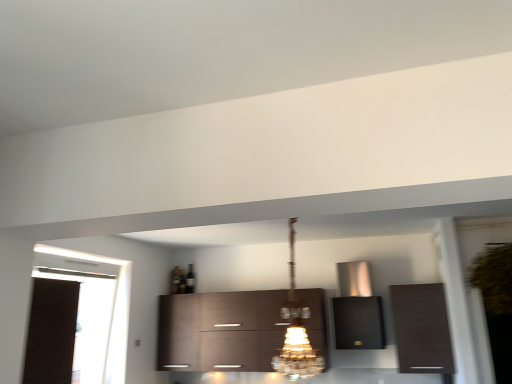
What do you see at coordinates (94, 309) in the screenshot? Image resolution: width=512 pixels, height=384 pixels. I see `black fabric curtain at left` at bounding box center [94, 309].

This screenshot has height=384, width=512. What do you see at coordinates (221, 331) in the screenshot?
I see `dark wood cabinet at center, acting as the 3th cabinetry starting from the right` at bounding box center [221, 331].

In order to click on satin metallic range hood at center, placed as the second cabinetry when sorted from right to left in this screenshot , I will do `click(358, 322)`.

At what (x,y) coordinates should I click in order to perform the action: click on crystal glass chandelier at center. Please return your answer as a coordinate pair (x, y). Looking at the image, I should click on pyautogui.click(x=296, y=331).

Is dark wood cabinet at right, which is the third cabinetry in left-to-right order, wider or thinner than satin metallic range hood at center, the 2th cabinetry viewed from the left?

In the image, dark wood cabinet at right, which is the third cabinetry in left-to-right order, appears to be more narrow than satin metallic range hood at center, the 2th cabinetry viewed from the left.

Would you say dark wood cabinet at right, which is the third cabinetry in left-to-right order, is a long distance from satin metallic range hood at center, placed as the second cabinetry when sorted from right to left?

dark wood cabinet at right, which is the third cabinetry in left-to-right order, is actually quite close to satin metallic range hood at center, placed as the second cabinetry when sorted from right to left.

Is dark wood cabinet at right, the first cabinetry viewed from the right, spatially inside satin metallic range hood at center, placed as the second cabinetry when sorted from right to left, or outside of it?

dark wood cabinet at right, the first cabinetry viewed from the right, cannot be found inside satin metallic range hood at center, placed as the second cabinetry when sorted from right to left.

Does dark wood cabinet at right, the first cabinetry viewed from the right, have a greater height compared to satin metallic range hood at center, the 2th cabinetry viewed from the left?

No.

Are black fabric curtain at left and crystal glass chandelier at center beside each other?

No, black fabric curtain at left is not making contact with crystal glass chandelier at center.

Considering the relative positions of black fabric curtain at left and crystal glass chandelier at center in the image provided, is black fabric curtain at left to the left of crystal glass chandelier at center from the viewer's perspective?

Indeed, black fabric curtain at left is positioned on the left side of crystal glass chandelier at center.

From a real-world perspective, who is located lower, black fabric curtain at left or crystal glass chandelier at center?

In real-world perspective, black fabric curtain at left is lower.

Is satin metallic range hood at center, placed as the second cabinetry when sorted from right to left, in contact with dark wood cabinet at right, the first cabinetry viewed from the right?

satin metallic range hood at center, placed as the second cabinetry when sorted from right to left, and dark wood cabinet at right, the first cabinetry viewed from the right, are clearly separated.

From a real-world perspective, which object rests below the other?

From a 3D spatial view, dark wood cabinet at right, the first cabinetry viewed from the right, is below.

Between point (350, 334) and point (438, 355), which one is positioned in front?

The point (438, 355) is in front.

Considering the points (46, 271) and (403, 356), which point is behind, point (46, 271) or point (403, 356)?

Point (403, 356)

Is black fabric curtain at left oriented towards dark wood cabinet at right, which is the third cabinetry in left-to-right order?

Yes, black fabric curtain at left is oriented towards dark wood cabinet at right, which is the third cabinetry in left-to-right order.

Based on their positions, is black fabric curtain at left located to the left or right of dark wood cabinet at right, which is the third cabinetry in left-to-right order?

black fabric curtain at left is to the left of dark wood cabinet at right, which is the third cabinetry in left-to-right order.

Between satin metallic range hood at center, the 2th cabinetry viewed from the left, and crystal glass chandelier at center, which one has larger width?

With larger width is crystal glass chandelier at center.

Does satin metallic range hood at center, placed as the second cabinetry when sorted from right to left, have a larger size compared to crystal glass chandelier at center?

No.

Measure the distance from satin metallic range hood at center, placed as the second cabinetry when sorted from right to left, to crystal glass chandelier at center.

4.39 feet.

Is satin metallic range hood at center, the 2th cabinetry viewed from the left, touching crystal glass chandelier at center?

No, satin metallic range hood at center, the 2th cabinetry viewed from the left, is not in contact with crystal glass chandelier at center.

From the picture: Considering the relative positions of crystal glass chandelier at center and dark wood cabinet at center, acting as the 3th cabinetry starting from the right, in the image provided, is crystal glass chandelier at center to the right of dark wood cabinet at center, acting as the 3th cabinetry starting from the right, from the viewer's perspective?

Yes, crystal glass chandelier at center is to the right of dark wood cabinet at center, acting as the 3th cabinetry starting from the right.

From a real-world perspective, between crystal glass chandelier at center and dark wood cabinet at center, acting as the 3th cabinetry starting from the right, who is vertically higher?

crystal glass chandelier at center is physically above.

Considering the positions of point (303, 312) and point (267, 291), is point (303, 312) closer or farther from the camera than point (267, 291)?

Clearly, point (303, 312) is closer to the camera than point (267, 291).

From the image's perspective, which one is positioned higher, crystal glass chandelier at center or dark wood cabinet at center, acting as the 3th cabinetry starting from the right?

crystal glass chandelier at center appears higher in the image.

Which is correct: dark wood cabinet at center, acting as the 3th cabinetry starting from the right, is inside crystal glass chandelier at center, or outside of it?

dark wood cabinet at center, acting as the 3th cabinetry starting from the right, exists outside the volume of crystal glass chandelier at center.

Is dark wood cabinet at center, the first cabinetry viewed from the left, bigger than crystal glass chandelier at center?

Yes.

In terms of height, does dark wood cabinet at center, acting as the 3th cabinetry starting from the right, look taller or shorter compared to crystal glass chandelier at center?

Clearly, dark wood cabinet at center, acting as the 3th cabinetry starting from the right, is shorter compared to crystal glass chandelier at center.

Are dark wood cabinet at center, acting as the 3th cabinetry starting from the right, and crystal glass chandelier at center far apart?

Yes, dark wood cabinet at center, acting as the 3th cabinetry starting from the right, and crystal glass chandelier at center are quite far apart.

Where is `the 1st cabinetry to the left of the dark wood cabinet at right, which is the third cabinetry in left-to-right order, starting your count from the anchor`? This screenshot has height=384, width=512. the 1st cabinetry to the left of the dark wood cabinet at right, which is the third cabinetry in left-to-right order, starting your count from the anchor is located at coordinates (358, 322).

The image size is (512, 384). I want to click on light fixture that is above the black fabric curtain at left (from a real-world perspective), so click(296, 331).

When comparing their distances from black fabric curtain at left, does crystal glass chandelier at center or dark wood cabinet at center, acting as the 3th cabinetry starting from the right, seem further?

Among the two, crystal glass chandelier at center is located further to black fabric curtain at left.

From the picture: Considering their positions, is dark wood cabinet at right, which is the third cabinetry in left-to-right order, positioned further to crystal glass chandelier at center than satin metallic range hood at center, the 2th cabinetry viewed from the left?

dark wood cabinet at right, which is the third cabinetry in left-to-right order, is further to crystal glass chandelier at center.

Based on the photo, considering their positions, is black fabric curtain at left positioned further to dark wood cabinet at right, the first cabinetry viewed from the right, than dark wood cabinet at center, the first cabinetry viewed from the left?

The object further to dark wood cabinet at right, the first cabinetry viewed from the right, is black fabric curtain at left.

From the image, which object appears to be farther from dark wood cabinet at center, acting as the 3th cabinetry starting from the right, satin metallic range hood at center, placed as the second cabinetry when sorted from right to left, or crystal glass chandelier at center?

crystal glass chandelier at center is further to dark wood cabinet at center, acting as the 3th cabinetry starting from the right.

Looking at the image, which one is located further to black fabric curtain at left, dark wood cabinet at center, the first cabinetry viewed from the left, or dark wood cabinet at right, which is the third cabinetry in left-to-right order?

dark wood cabinet at right, which is the third cabinetry in left-to-right order, is positioned further to the anchor black fabric curtain at left.

From the image, which object appears to be nearer to satin metallic range hood at center, placed as the second cabinetry when sorted from right to left, dark wood cabinet at right, which is the third cabinetry in left-to-right order, or crystal glass chandelier at center?

dark wood cabinet at right, which is the third cabinetry in left-to-right order, lies closer to satin metallic range hood at center, placed as the second cabinetry when sorted from right to left, than the other object.

Based on their spatial positions, is satin metallic range hood at center, the 2th cabinetry viewed from the left, or dark wood cabinet at right, the first cabinetry viewed from the right, closer to black fabric curtain at left?

The object closer to black fabric curtain at left is satin metallic range hood at center, the 2th cabinetry viewed from the left.

Looking at the image, which one is located closer to dark wood cabinet at center, the first cabinetry viewed from the left, black fabric curtain at left or crystal glass chandelier at center?

black fabric curtain at left is positioned closer to the anchor dark wood cabinet at center, the first cabinetry viewed from the left.

Identify the location of light fixture between black fabric curtain at left and satin metallic range hood at center, the 2th cabinetry viewed from the left, from left to right. This screenshot has height=384, width=512. (296, 331).

What are the coordinates of `cabinetry between crystal glass chandelier at center and satin metallic range hood at center, placed as the second cabinetry when sorted from right to left, from front to back` in the screenshot? It's located at (421, 329).

At what (x,y) coordinates should I click in order to perform the action: click on light fixture situated between black fabric curtain at left and dark wood cabinet at right, the first cabinetry viewed from the right, from left to right. Please return your answer as a coordinate pair (x, y). This screenshot has width=512, height=384. Looking at the image, I should click on (296, 331).

Image resolution: width=512 pixels, height=384 pixels. Identify the location of cabinetry located between black fabric curtain at left and satin metallic range hood at center, the 2th cabinetry viewed from the left, in the left-right direction. pyautogui.click(x=221, y=331).